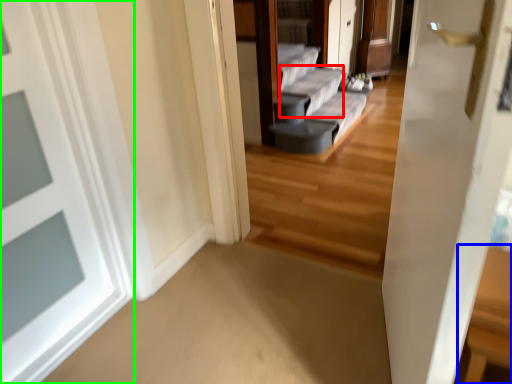
Question: Which object is the farthest from couch (highlighted by a red box)? Choose among these: table (highlighted by a blue box) or door (highlighted by a green box).

Choices:
 (A) table
 (B) door

Answer: (A)